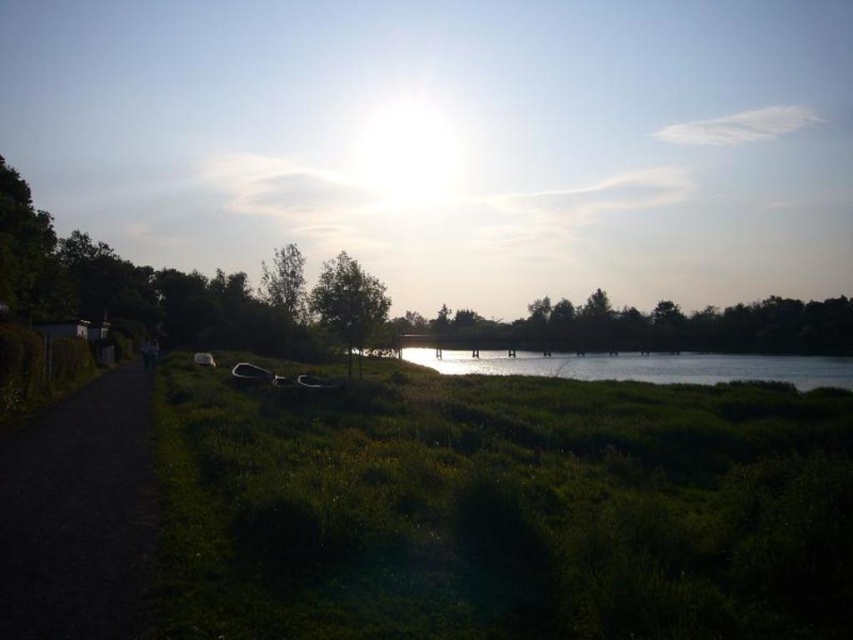
You are standing at the lakeside and want to take a photo of the dark asphalt path at left and the green leafy trees at center. Which object should you focus on first if you want both to be in sharp focus?

You should focus on the green leafy trees at center first because the dark asphalt path at left is in front of them, so focusing on the farther object ensures both are in focus with proper depth of field.